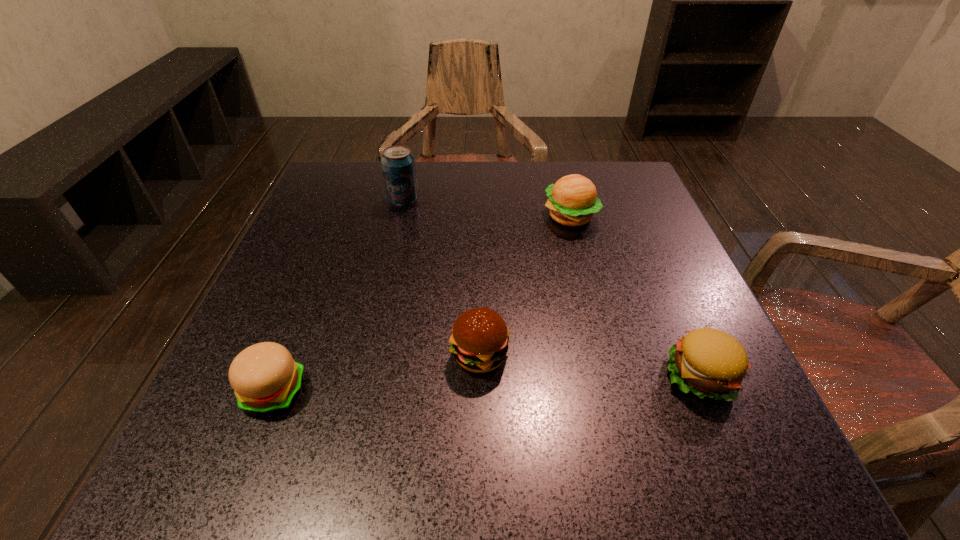
Find the location of `vacant region that satisfies the following two spatial constraints: 1. on the back side of the leftmost object; 2. on the right side of the second hamburger from left to right`. vacant region that satisfies the following two spatial constraints: 1. on the back side of the leftmost object; 2. on the right side of the second hamburger from left to right is located at coordinates (288, 355).

Where is `vacant area in the image that satisfies the following two spatial constraints: 1. on the front side of the third hamburger from right to left; 2. on the right side of the tallest object`? The width and height of the screenshot is (960, 540). vacant area in the image that satisfies the following two spatial constraints: 1. on the front side of the third hamburger from right to left; 2. on the right side of the tallest object is located at coordinates (369, 355).